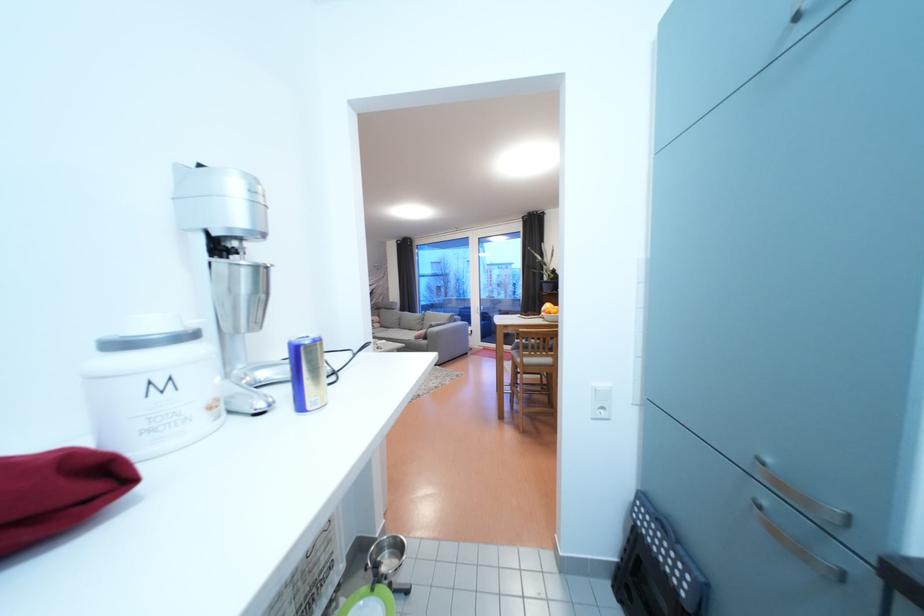
Locate an element on the screen. white light switch is located at coordinates (601, 402).